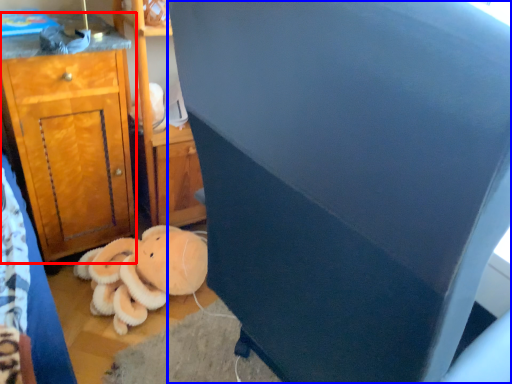
Question: Which object is further to the camera taking this photo, cabinetry (highlighted by a red box) or furniture (highlighted by a blue box)?

Choices:
 (A) cabinetry
 (B) furniture

Answer: (A)